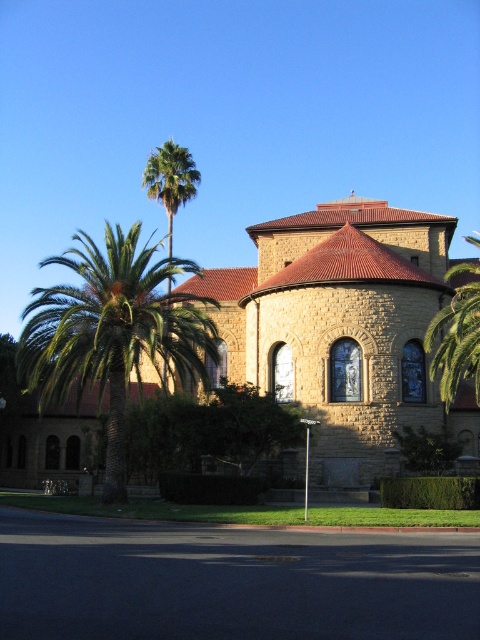
Can you confirm if brown stone church at center is thinner than green leafy palm at upper left?

Incorrect, brown stone church at center's width is not less than green leafy palm at upper left's.

Is brown stone church at center above green leafy palm at upper left?

No, brown stone church at center is not above green leafy palm at upper left.

Does point (392, 257) come behind point (168, 193)?

No, it is in front of (168, 193).

Where is `brown stone church at center`? The height and width of the screenshot is (640, 480). brown stone church at center is located at coordinates (343, 328).

Where is `green leafy palm at left`? green leafy palm at left is located at coordinates (111, 330).

Is green leafy palm at left above green leafy palm at upper left?

Actually, green leafy palm at left is below green leafy palm at upper left.

You are a GUI agent. You are given a task and a screenshot of the screen. Output one action in this format:
    pyautogui.click(x=<x>, y=<y>)
    Task: Click on the green leafy palm at left
    The image size is (480, 640).
    Given the screenshot: What is the action you would take?
    pyautogui.click(x=111, y=330)

Which is more to the right, green leafy palm at left or green leafy palm tree at right?

From the viewer's perspective, green leafy palm tree at right appears more on the right side.

What do you see at coordinates (111, 330) in the screenshot? I see `green leafy palm at left` at bounding box center [111, 330].

Identify the location of green leafy palm at left. (111, 330).

This screenshot has height=640, width=480. In order to click on green leafy palm at left in this screenshot , I will do `click(111, 330)`.